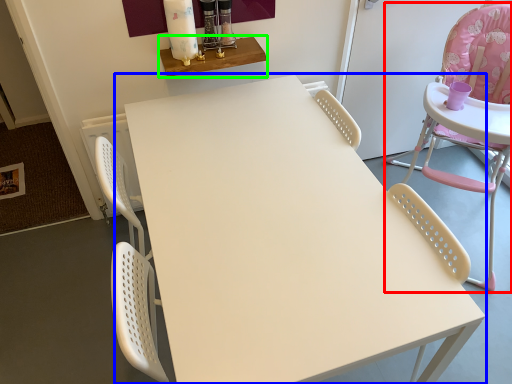
Question: Considering the real-world distances, which object is closest to chair (highlighted by a red box)? table (highlighted by a blue box) or table (highlighted by a green box).

Choices:
 (A) table
 (B) table

Answer: (A)